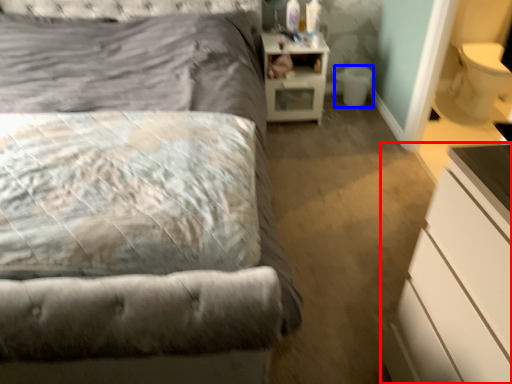
Question: Which of the following is the farthest to the observer, chest of drawers (highlighted by a red box) or toilet bowl (highlighted by a blue box)?

Choices:
 (A) chest of drawers
 (B) toilet bowl

Answer: (B)